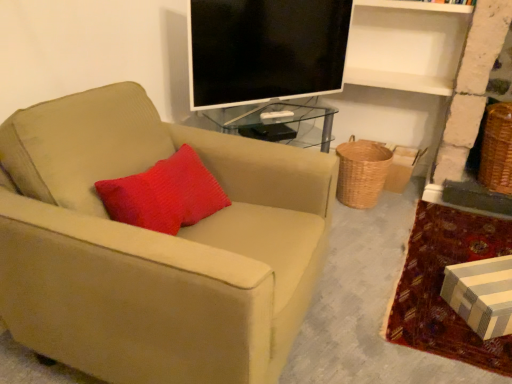
The image size is (512, 384). I want to click on vacant space situated on the left part of striped cardboard box at lower right, so pyautogui.click(x=357, y=276).